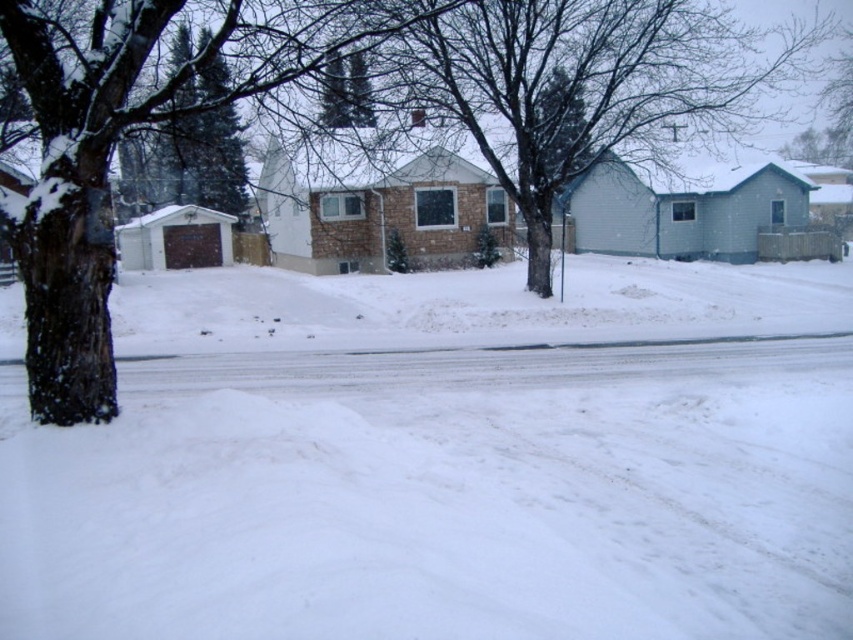
You are standing at the center of the snowy street and want to walk towards the tree trunk on the left. Is the white fluffy snow at lower center in your path?

The white fluffy snow at lower center is located at point (445, 461), which is to the right of your path towards the tree trunk on the left. Therefore, it is not in your path.

Based on the photo, you are a snowplow operator who needs to clear the snow from the road. You notice the white fluffy snow at lower center and the bare branches at center. Which object is located below the other?

The white fluffy snow at lower center is positioned under the bare branches at center, so the snow is below the branches.